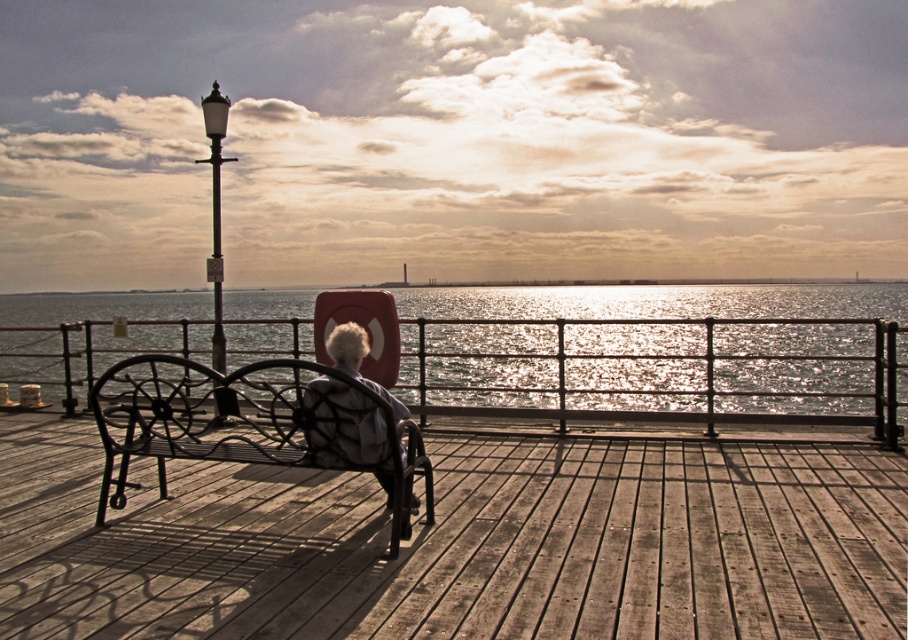
You are a GUI agent. You are given a task and a screenshot of the screen. Output one action in this format:
    pyautogui.click(x=<x>, y=<y>)
    Task: Click on the wooden at center
    
    Given the screenshot: What is the action you would take?
    pyautogui.click(x=459, y=541)

Is wooden at center smaller than black wrought iron bench at center?

Yes.

Is point (859, 536) positioned in front of point (109, 468)?

That is True.

What are the coordinates of `wooden at center` in the screenshot? It's located at (459, 541).

Which of these two, shiny metallic water at center or white textured hair at center, stands taller?

Standing taller between the two is shiny metallic water at center.

Is point (752, 307) positioned after point (351, 360)?

Yes, point (752, 307) is farther from viewer.

Who is more distant from viewer, (x=855, y=317) or (x=370, y=387)?

Point (x=855, y=317)

The height and width of the screenshot is (640, 908). I want to click on shiny metallic water at center, so click(x=660, y=355).

Does wooden at center appear on the right side of white textured hair at center?

Correct, you'll find wooden at center to the right of white textured hair at center.

Is point (716, 609) closer to viewer compared to point (382, 481)?

Yes.

Does point (28, 545) come in front of point (356, 372)?

No, (28, 545) is behind (356, 372).

What are the coordinates of `wooden at center` in the screenshot? It's located at (459, 541).